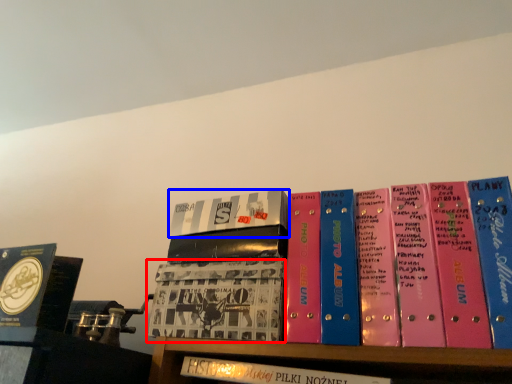
Question: Among these objects, which one is nearest to the camera, book (highlighted by a red box) or book (highlighted by a blue box)?

Choices:
 (A) book
 (B) book

Answer: (A)